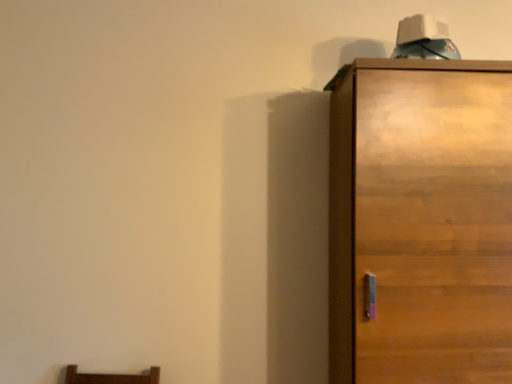
This screenshot has height=384, width=512. Find the location of `wooden cabinet at right`. wooden cabinet at right is located at coordinates coord(421,222).

The height and width of the screenshot is (384, 512). What do you see at coordinates (421, 222) in the screenshot?
I see `wooden cabinet at right` at bounding box center [421, 222].

Image resolution: width=512 pixels, height=384 pixels. I want to click on wooden cabinet at right, so click(421, 222).